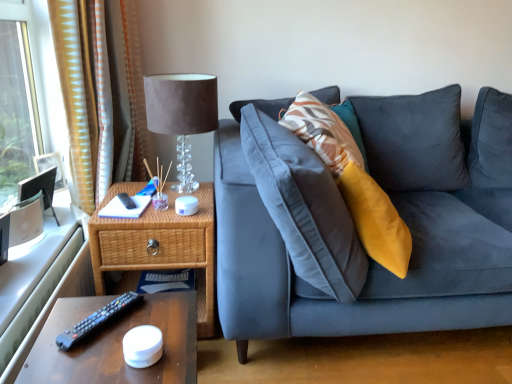
Image resolution: width=512 pixels, height=384 pixels. What are the coordinates of `free location in front of black plastic remote at lower left` in the screenshot? It's located at (87, 359).